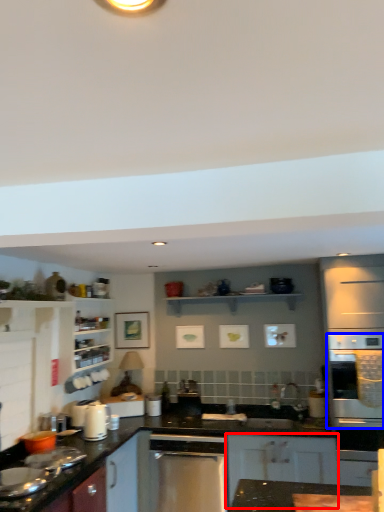
Question: Among these objects, which one is nearest to the camera, cabinetry (highlighted by a red box) or oven (highlighted by a blue box)?

Choices:
 (A) cabinetry
 (B) oven

Answer: (B)